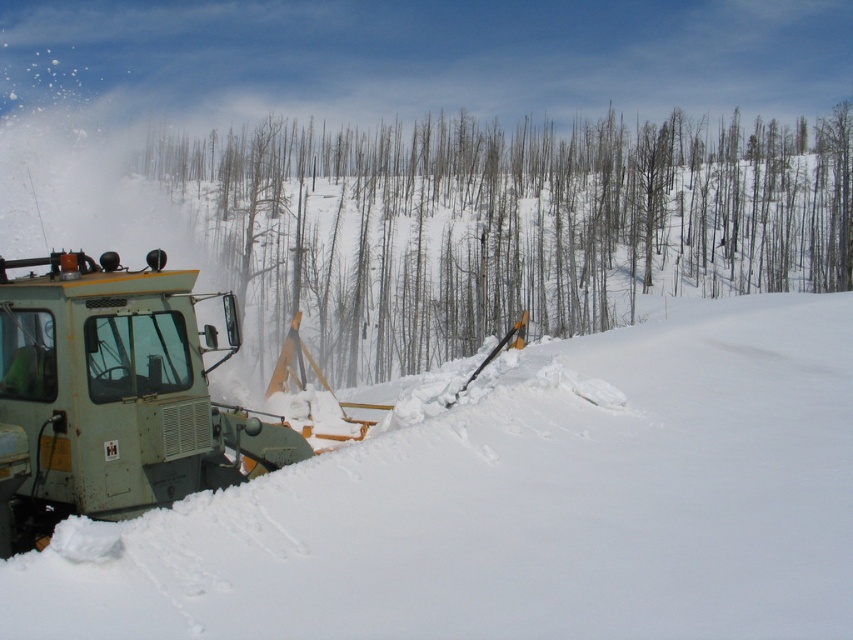
Between point (761, 512) and point (223, 305), which one is positioned in front?

Positioned in front is point (761, 512).

Measure the distance from white powdery snow at lower left to green matte snowplow at lower left.

The distance of white powdery snow at lower left from green matte snowplow at lower left is 4.18 meters.

Describe the element at coordinates (518, 504) in the screenshot. I see `white powdery snow at lower left` at that location.

Where is `white powdery snow at lower left`? The image size is (853, 640). white powdery snow at lower left is located at coordinates (518, 504).

Can you confirm if gray bark trees at center is shorter than green matte snowplow at lower left?

In fact, gray bark trees at center may be taller than green matte snowplow at lower left.

Does point (334, 243) lie in front of point (163, 292)?

No, it is behind (163, 292).

Where is `gray bark trees at center`? This screenshot has width=853, height=640. gray bark trees at center is located at coordinates (512, 224).

Can you confirm if white powdery snow at lower left is thinner than gray bark trees at center?

Indeed, white powdery snow at lower left has a lesser width compared to gray bark trees at center.

Can you confirm if white powdery snow at lower left is shorter than gray bark trees at center?

Indeed, white powdery snow at lower left has a lesser height compared to gray bark trees at center.

From the picture: Measure the distance between point (811, 472) and camera.

Point (811, 472) and camera are 24.06 feet apart.

This screenshot has width=853, height=640. What are the coordinates of `white powdery snow at lower left` in the screenshot? It's located at (518, 504).